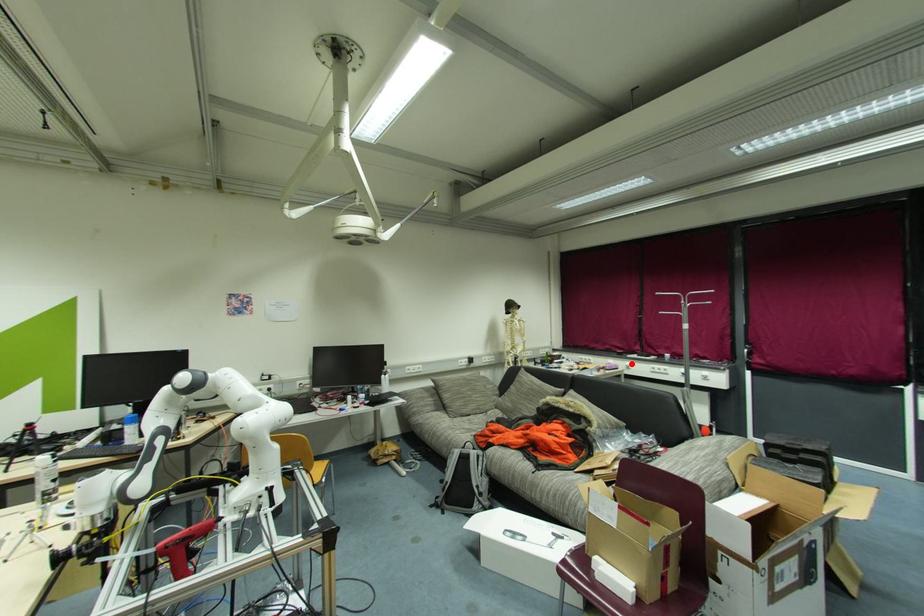
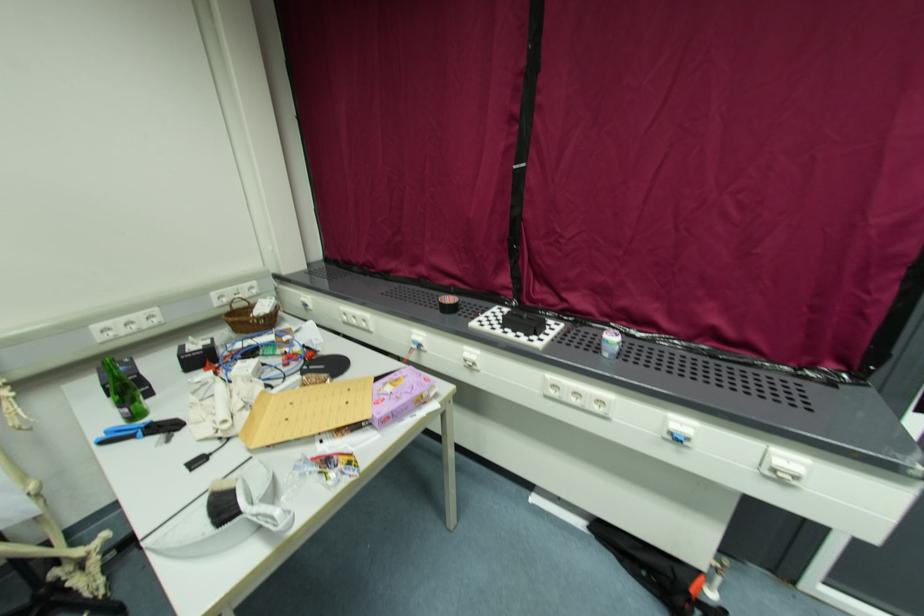
Locate, in the second image, the point that corresponds to the highlighted location in the first image.

(476, 352)